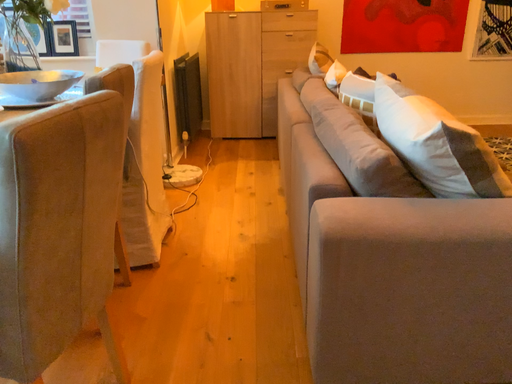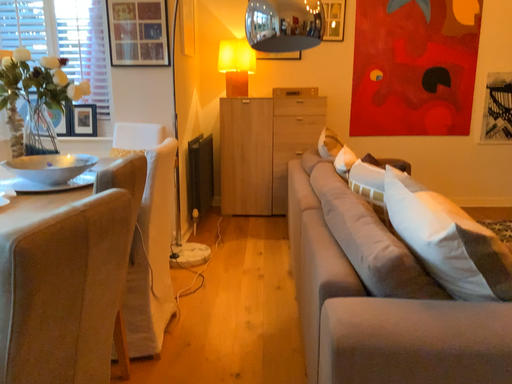
Question: How did the camera likely rotate when shooting the video?

Choices:
 (A) rotated downward
 (B) rotated upward

Answer: (B)